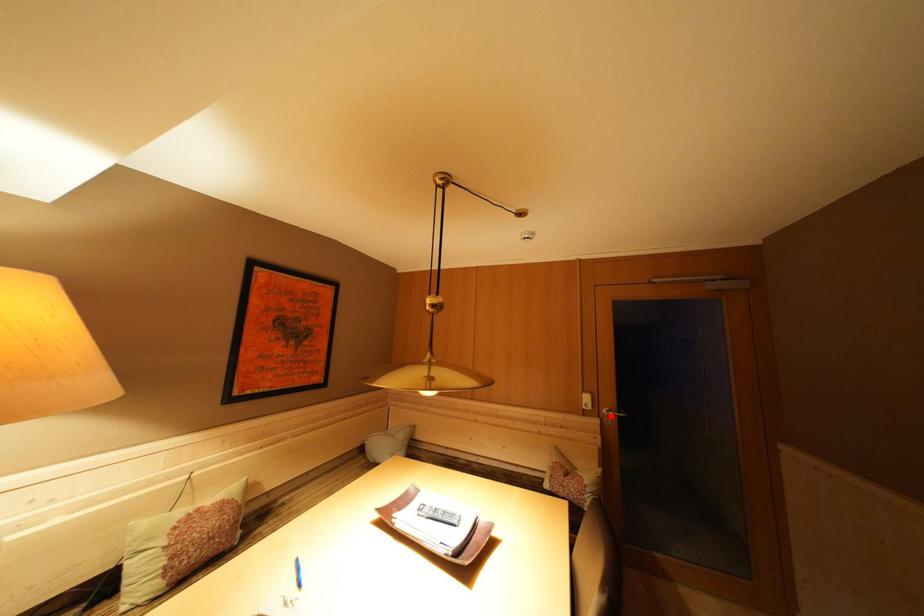
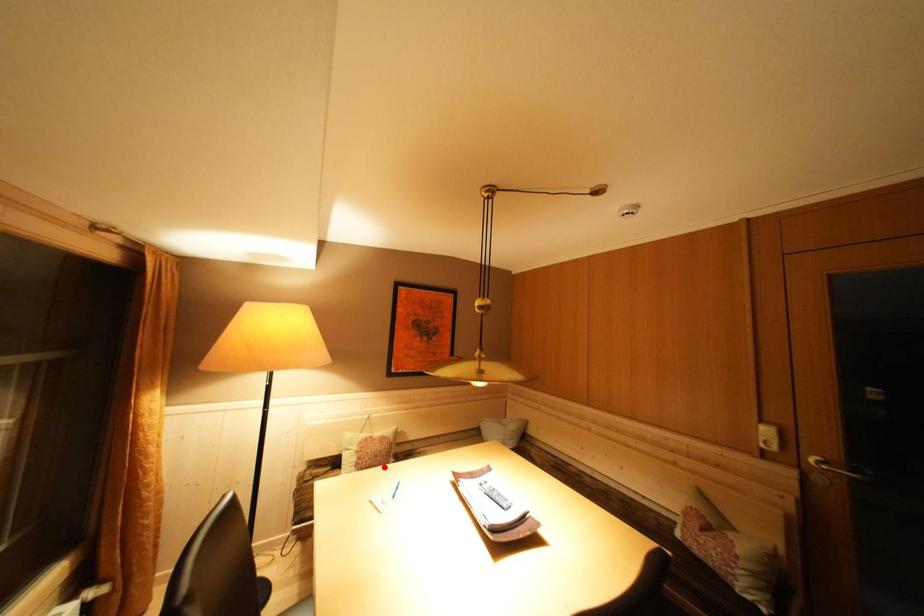
I am providing you with two images of the same scene from different viewpoints. A red point is marked on the first image and another point is marked on the second image. Does the point marked in image1 correspond to the same location as the one in image2?

No